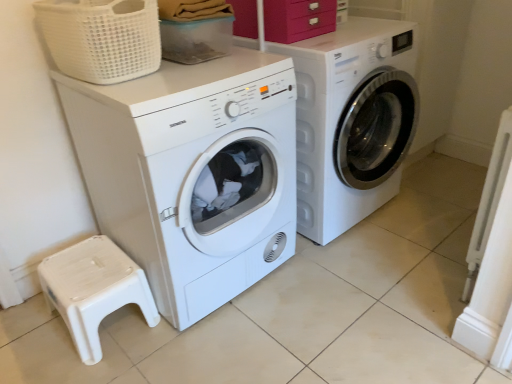
At what (x,y) coordinates should I click in order to perform the action: click on vacant area that lies to the right of white plastic step stool at lower left. Please return your answer as a coordinate pair (x, y). The image size is (512, 384). Looking at the image, I should click on (178, 345).